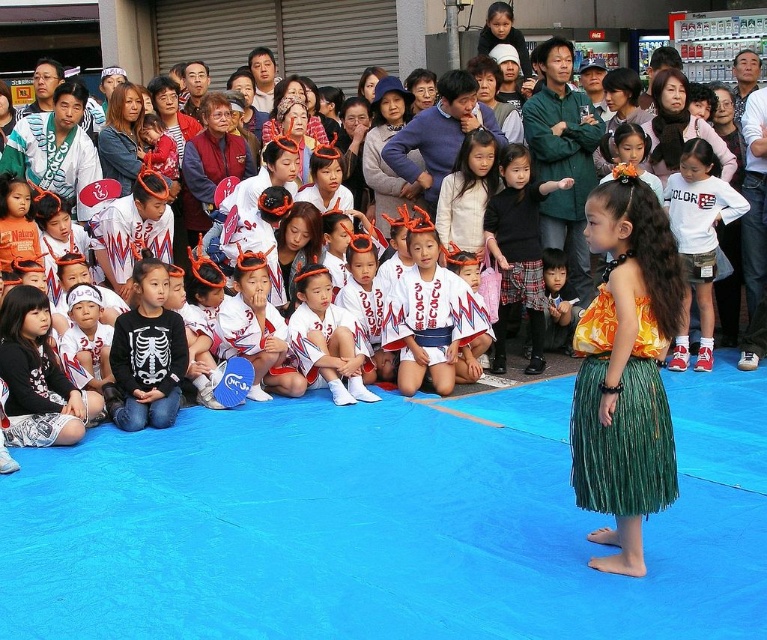
From the picture: You are a photographer trying to capture the best shot of the hula dancer and the group of children. You want to focus on the point at point [670,461] and point [318,282]. Which point should you prioritize if you want to highlight the subject that is closer to you?

→ Point [670,461] is closer to the viewer than point [318,282], so you should prioritize focusing on point [670,461] to highlight the subject that is closer to you.

You are a photographer at the event and want to capture a photo where both the black fabric skirt at center and the white cotton shirt at center are visible. Which object should you focus on to ensure both are in frame?

The black fabric skirt at center has a greater height compared to the white cotton shirt at center. To ensure both are in frame, focus on the black fabric skirt at center as it is taller and will help frame the shot to include the white cotton shirt at center.

You are a photographer trying to capture the scene. You need to focus on the green grass skirt at lower right and the white fabric uniform at center. Which one is located more to the right side of the image?

The green grass skirt at lower right is positioned on the right side of the white fabric uniform at center, so it is more to the right.